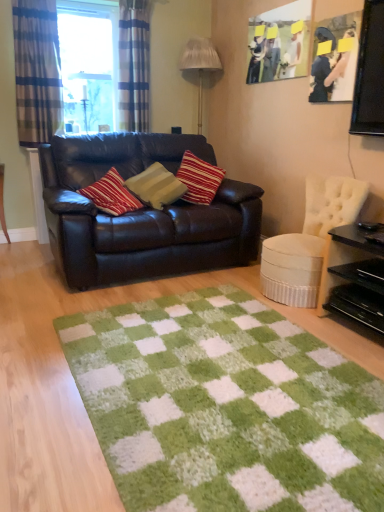
Measure the distance between green shaggy rug at center and camera.

They are 4.03 feet apart.

What do you see at coordinates (134, 65) in the screenshot? The image size is (384, 512). I see `blue plaid curtain at upper left, the 2th curtain positioned from the left` at bounding box center [134, 65].

Find the location of `matte black couch at center`. matte black couch at center is located at coordinates (141, 213).

From the image's perspective, between white tufted chair at right and striped fabric pillow at center, who is located below?

white tufted chair at right.

How many degrees apart are the facing directions of white tufted chair at right and striped fabric pillow at center?

125 degrees separate the facing orientations of white tufted chair at right and striped fabric pillow at center.

Would you say white tufted chair at right is outside striped fabric pillow at center?

Yes, white tufted chair at right is outside of striped fabric pillow at center.

Can you confirm if white tufted chair at right is positioned to the right of striped fabric pillow at center?

Indeed, white tufted chair at right is positioned on the right side of striped fabric pillow at center.

Is the surface of white tufted chair at right in direct contact with blue plaid curtain at upper left, marked as the 1th curtain in a right-to-left arrangement?

No.

From the image's perspective, which is below, white tufted chair at right or blue plaid curtain at upper left, marked as the 1th curtain in a right-to-left arrangement?

From the image's view, white tufted chair at right is below.

Is white tufted chair at right not within blue plaid curtain at upper left, marked as the 1th curtain in a right-to-left arrangement?

Absolutely, white tufted chair at right is external to blue plaid curtain at upper left, marked as the 1th curtain in a right-to-left arrangement.

Is striped fabric pillow at center next to white pleated fabric lampshade at upper center and touching it?

There is a gap between striped fabric pillow at center and white pleated fabric lampshade at upper center.

Looking at this image, is striped fabric pillow at center situated inside white pleated fabric lampshade at upper center or outside?

striped fabric pillow at center cannot be found inside white pleated fabric lampshade at upper center.

Is striped fabric pillow at center turned away from white pleated fabric lampshade at upper center?

No.

From a real-world perspective, is striped fabric pillow at center physically below white pleated fabric lampshade at upper center?

Yes, from a real-world perspective, striped fabric pillow at center is under white pleated fabric lampshade at upper center.

Can we say black glossy table at right lies outside matte black picture frame at upper right, placed as the 1th picture frame when sorted from right to left?

Yes.

Are black glossy table at right and matte black picture frame at upper right, placed as the 1th picture frame when sorted from right to left, far apart?

Yes, black glossy table at right and matte black picture frame at upper right, placed as the 1th picture frame when sorted from right to left, are located far from each other.

Considering the positions of objects black glossy table at right and matte black picture frame at upper right, placed as the 1th picture frame when sorted from right to left, in the image provided, who is more to the right, black glossy table at right or matte black picture frame at upper right, placed as the 1th picture frame when sorted from right to left,?

From the viewer's perspective, black glossy table at right appears more on the right side.

Could you measure the distance between black glossy table at right and matte black picture frame at upper right, placed as the 1th picture frame when sorted from right to left?

black glossy table at right is 3.85 feet away from matte black picture frame at upper right, placed as the 1th picture frame when sorted from right to left.

Is point (112, 376) closer or farther from the camera than point (188, 45)?

Point (112, 376).

Which object is wider, green shaggy rug at center or white pleated fabric lampshade at upper center?

Wider between the two is green shaggy rug at center.

Is green shaggy rug at center to the left of white pleated fabric lampshade at upper center from the viewer's perspective?

No.

Is there a large distance between green shaggy rug at center and white pleated fabric lampshade at upper center?

Yes, green shaggy rug at center and white pleated fabric lampshade at upper center are quite far apart.

Between striped fabric pillow at center and clear glass window at upper left, which one has larger width?

striped fabric pillow at center.

Choose the correct answer: Is striped fabric pillow at center inside clear glass window at upper left or outside it?

striped fabric pillow at center is spatially situated outside clear glass window at upper left.

Based on their sizes in the image, would you say black glossy table at right is bigger or smaller than white pleated fabric lampshade at upper center?

black glossy table at right is smaller than white pleated fabric lampshade at upper center.

Choose the correct answer: Is black glossy table at right inside white pleated fabric lampshade at upper center or outside it?

black glossy table at right is not enclosed by white pleated fabric lampshade at upper center.

Which is more to the left, black glossy table at right or white pleated fabric lampshade at upper center?

white pleated fabric lampshade at upper center.

Considering the positions of objects black glossy table at right and white pleated fabric lampshade at upper center in the image provided, who is in front, black glossy table at right or white pleated fabric lampshade at upper center?

black glossy table at right is in front.

This screenshot has height=512, width=384. Find the location of `pillow on the left of the white tufted chair at right`. pillow on the left of the white tufted chair at right is located at coordinates (156, 186).

The height and width of the screenshot is (512, 384). Find the location of `chair directly beneath the blue plaid curtain at upper left, the 2th curtain positioned from the left (from a real-world perspective)`. chair directly beneath the blue plaid curtain at upper left, the 2th curtain positioned from the left (from a real-world perspective) is located at coordinates (309, 241).

From the picture: From the image, which object appears to be farther from matte black couch at center, white tufted chair at right or blue plaid curtain at upper left, the 2th curtain positioned from the left?

blue plaid curtain at upper left, the 2th curtain positioned from the left, is positioned further to the anchor matte black couch at center.

Which object lies nearer to the anchor point white tufted chair at right, clear glass window at upper left or plaid fabric curtain at left, which is the first curtain in left-to-right order?

clear glass window at upper left is closer to white tufted chair at right.

Considering their positions, is plaid fabric curtain at left, acting as the second curtain starting from the right, positioned closer to black plastic drawer at lower right than striped fabric pillow at center?

striped fabric pillow at center is closer to black plastic drawer at lower right.

Which object lies nearer to the anchor point black plastic drawer at lower right, blue plaid curtain at upper left, marked as the 1th curtain in a right-to-left arrangement, or white pleated fabric lampshade at upper center?

white pleated fabric lampshade at upper center.

From the image, which object appears to be nearer to clear glass window at upper left, white pleated fabric lampshade at upper center or matte black couch at center?

white pleated fabric lampshade at upper center.

Based on their spatial positions, is white tufted chair at right or blue plaid curtain at upper left, the 2th curtain positioned from the left, closer to matte black picture frame at upper right, arranged as the 1th picture frame when viewed from the front?

Among the two, white tufted chair at right is located nearer to matte black picture frame at upper right, arranged as the 1th picture frame when viewed from the front.

Based on their spatial positions, is green shaggy rug at center or clear glass window at upper left closer to matte black picture frame at upper right, the second picture frame in the back-to-front sequence?

Among the two, green shaggy rug at center is located nearer to matte black picture frame at upper right, the second picture frame in the back-to-front sequence.

Based on the photo, considering their positions, is black glossy table at right positioned further to green shaggy rug at center than white tufted chair at right?

The object further to green shaggy rug at center is white tufted chair at right.

Locate an element on the screen. Image resolution: width=384 pixels, height=512 pixels. drawer located between plaid fabric curtain at left, acting as the second curtain starting from the right, and black glossy table at right in the left-right direction is located at coordinates (358, 305).

I want to click on pillow between plaid fabric curtain at left, which is the first curtain in left-to-right order, and black plastic drawer at lower right, so pos(156,186).

I want to click on pillow between clear glass window at upper left and black glossy table at right in the horizontal direction, so coord(156,186).

Identify the location of picture frame located between clear glass window at upper left and white tufted chair at right in the left-right direction. The height and width of the screenshot is (512, 384). (279, 42).